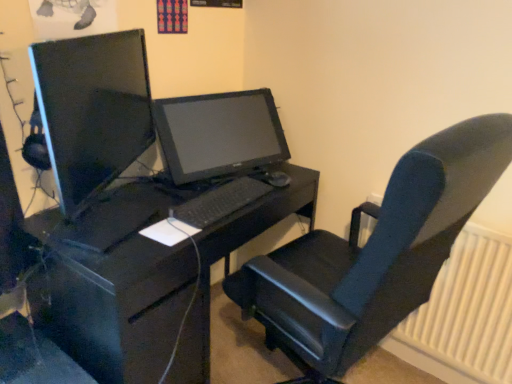
Identify the location of free spot below matte black monitor at left (from a real-world perspective). (109, 223).